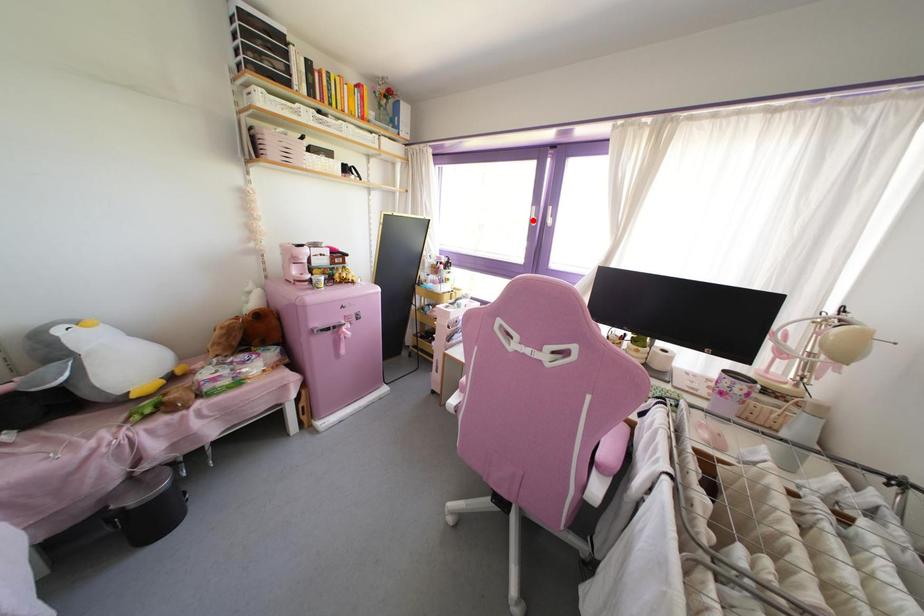
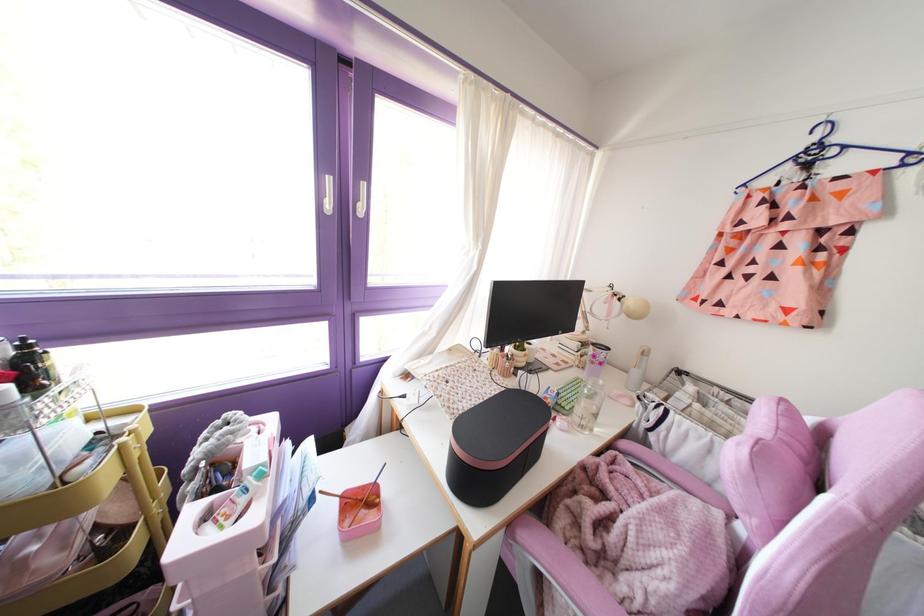
Question: I am providing you with two images of the same scene from different viewpoints. Given a red point in image1, look at the same physical point in image2. Is it:

Choices:
 (A) Closer to the viewpoint
 (B) Farther from the viewpoint

Answer: (B)